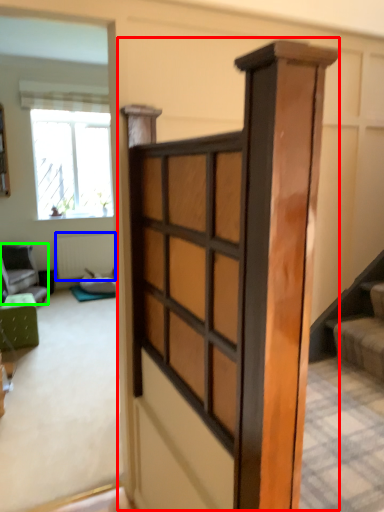
Question: Which is nearer to the barn door (highlighted by a red box)? radiator (highlighted by a blue box) or furniture (highlighted by a green box).

Choices:
 (A) radiator
 (B) furniture

Answer: (B)